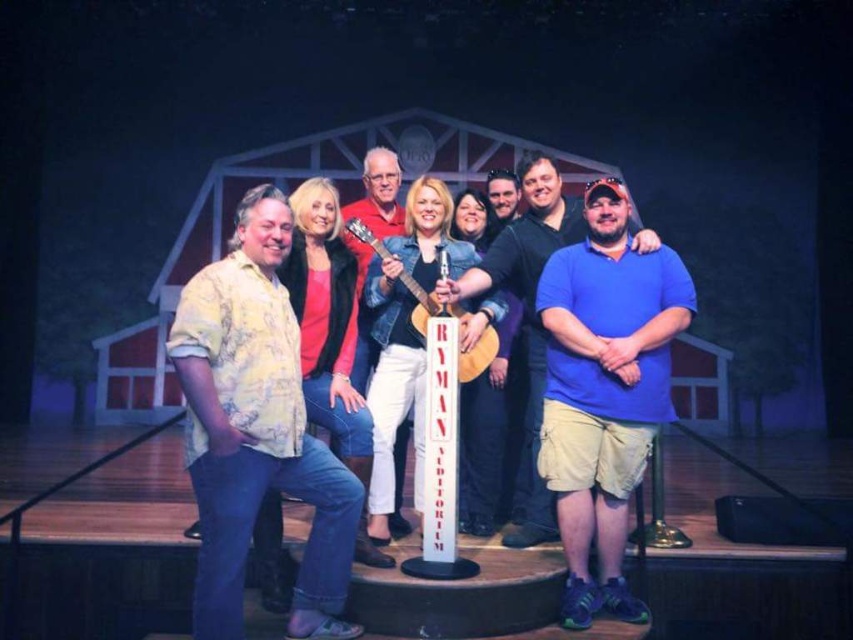
You are a photographer on stage and need to adjust the lighting between the yellow floral shirt at left and the matte red shirt at center. How far apart are these two shirts?

The yellow floral shirt at left is 39.32 inches from the matte red shirt at center.

You are an event planner arranging a photo shoot for the group. You need to place a large banner behind the yellow floral shirt at left and the matte red shirt at center. Which shirt should the banner be placed behind to ensure it doesn

The yellow floral shirt at left is bigger than the matte red shirt at center, so the banner should be placed behind the yellow floral shirt at left to ensure it stands out more against the background.